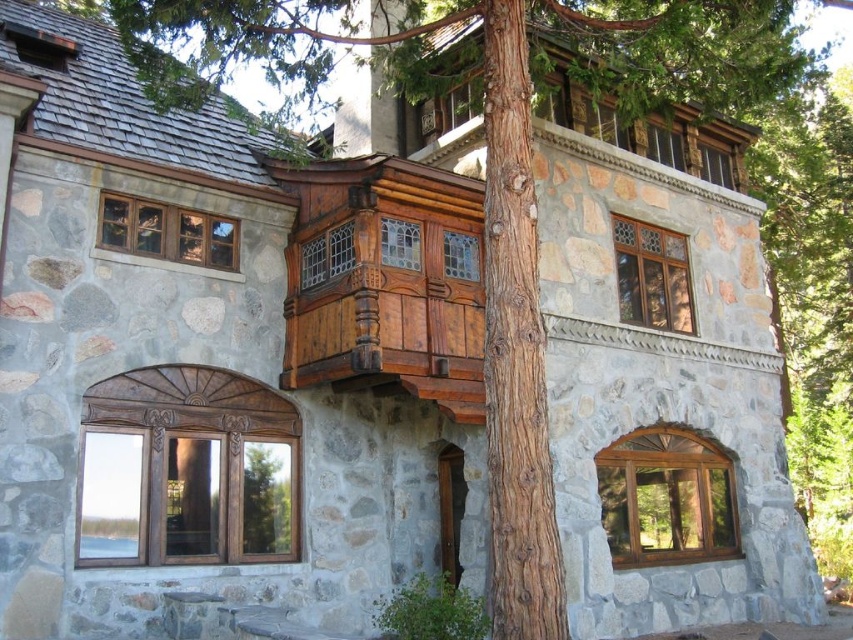
Does brown rough bark at center appear over wooden balcony at upper center?

No, brown rough bark at center is not above wooden balcony at upper center.

Who is shorter, brown rough bark at center or wooden balcony at upper center?

wooden balcony at upper center

Does point (558, 541) come behind point (642, 124)?

No.

I want to click on brown rough bark at center, so click(515, 349).